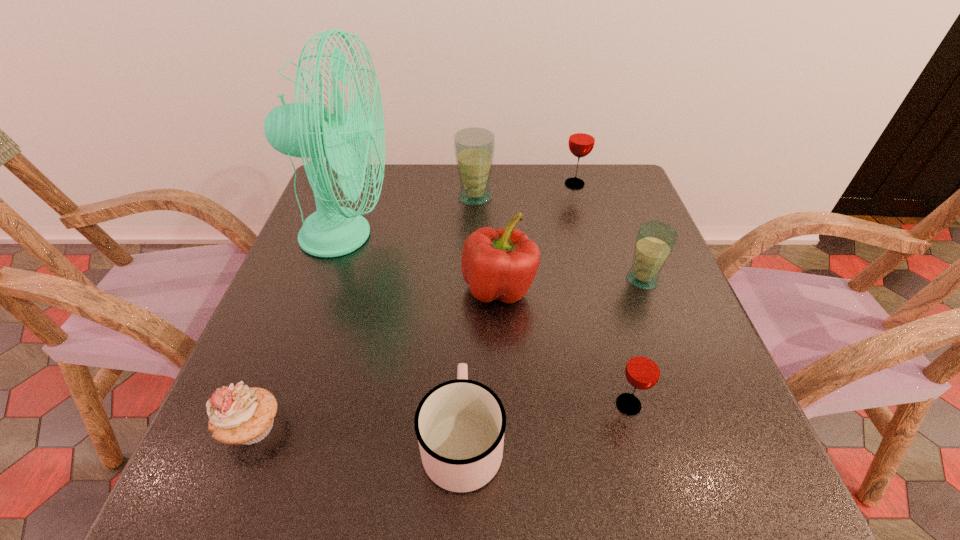
Locate an element on the screen. cupcake is located at coordinates (238, 414).

You are a GUI agent. You are given a task and a screenshot of the screen. Output one action in this format:
    pyautogui.click(x=<x>, y=<y>)
    Task: Click on the mug
    This screenshot has width=960, height=540.
    Given the screenshot: What is the action you would take?
    pyautogui.click(x=460, y=424)

Where is `free space located 0.080m in front of the blue fan to blow air`? free space located 0.080m in front of the blue fan to blow air is located at coordinates (423, 235).

The height and width of the screenshot is (540, 960). Identify the location of vacant space positioned on the left of the farther red glass. (492, 184).

Where is `free spot located 0.210m on the left of the farther blue glass`? free spot located 0.210m on the left of the farther blue glass is located at coordinates (380, 197).

Where is `vacant space located on the front of the pink bell pepper`? vacant space located on the front of the pink bell pepper is located at coordinates (503, 387).

Identify the location of vacant space located 0.220m on the left of the right blue glass. This screenshot has width=960, height=540. (526, 280).

Locate an element on the screen. This screenshot has width=960, height=540. free space located on the back of the smaller red glass is located at coordinates (604, 311).

Find the location of `vacant space located on the right of the cupcake`. vacant space located on the right of the cupcake is located at coordinates (440, 427).

Find the location of a particular element. This screenshot has width=960, height=540. vacant space located on the side of the mug with the handle is located at coordinates (465, 364).